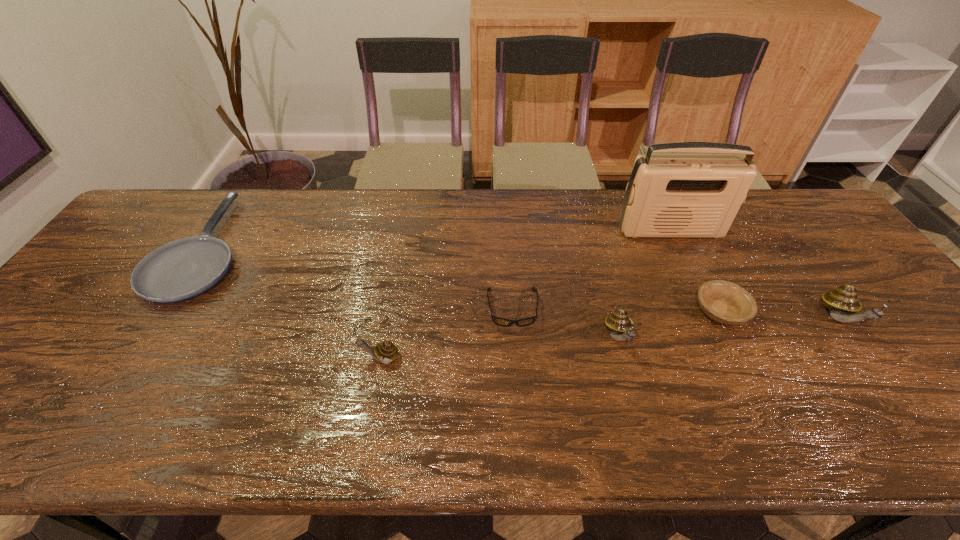
Image resolution: width=960 pixels, height=540 pixels. Find the location of `the shortest snail`. the shortest snail is located at coordinates (385, 352).

The width and height of the screenshot is (960, 540). I want to click on the fourth shortest object, so click(385, 352).

At what (x,y) coordinates should I click in order to perform the action: click on the fourth object from right to left. Please return your answer as a coordinate pair (x, y). This screenshot has width=960, height=540. Looking at the image, I should click on (618, 322).

Identify the location of the second tallest snail. [x=618, y=322].

Image resolution: width=960 pixels, height=540 pixels. I want to click on the tallest snail, so click(x=843, y=304).

I want to click on the rightmost snail, so click(x=843, y=304).

Where is `radio receiver`? The height and width of the screenshot is (540, 960). radio receiver is located at coordinates (678, 196).

At what (x,y) coordinates should I click in order to perform the action: click on frying pan. Please return your answer as a coordinate pair (x, y). The image size is (960, 540). Looking at the image, I should click on (184, 268).

Locate an element on the screen. The image size is (960, 540). the third object from left to right is located at coordinates (499, 321).

At what (x,y) coordinates should I click in order to perform the action: click on bowl. Please return your answer as a coordinate pair (x, y). This screenshot has height=540, width=960. Looking at the image, I should click on (724, 302).